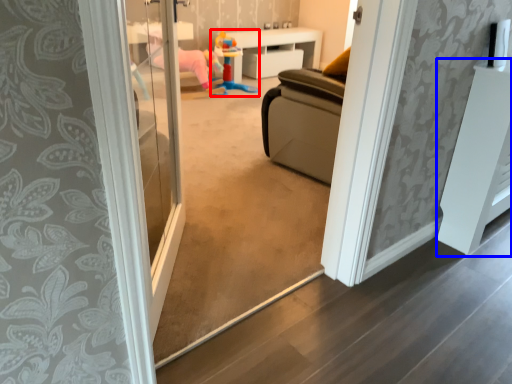
Question: Among these objects, which one is farthest to the camera, toy (highlighted by a red box) or furniture (highlighted by a blue box)?

Choices:
 (A) toy
 (B) furniture

Answer: (A)